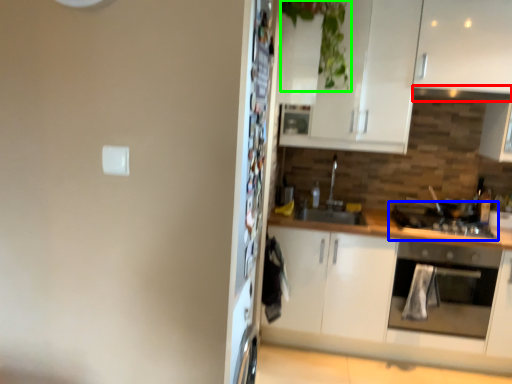
Question: Which object is positioned closest to exhaust hood (highlighted by a red box)? Select from gas stove (highlighted by a blue box) and plant (highlighted by a green box).

Choices:
 (A) gas stove
 (B) plant

Answer: (A)